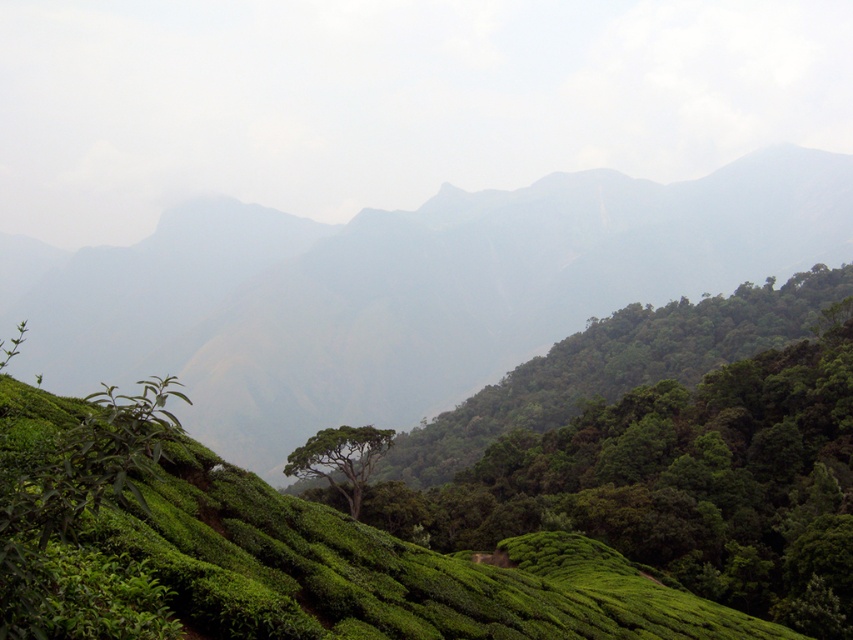
Is the position of green leafy hillside at center more distant than that of green leafy tree at center?

Yes, green leafy hillside at center is behind green leafy tree at center.

Who is positioned more to the right, green leafy hillside at center or green leafy tree at center?

green leafy tree at center is more to the right.

Find the location of `green leafy hillside at center`. green leafy hillside at center is located at coordinates (401, 291).

Where is `green leafy hillside at center`? green leafy hillside at center is located at coordinates (401, 291).